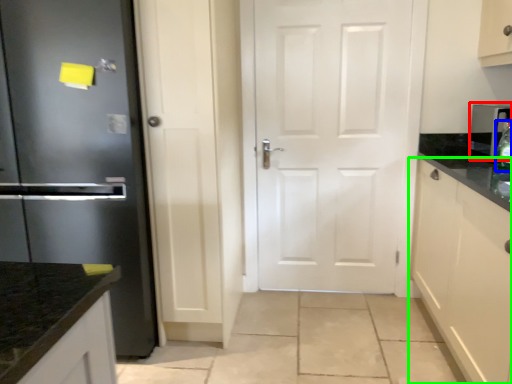
Question: Considering the real-world distances, which object is closest to appliance (highlighted by a red box)? bottle (highlighted by a blue box) or cabinetry (highlighted by a green box).

Choices:
 (A) bottle
 (B) cabinetry

Answer: (A)